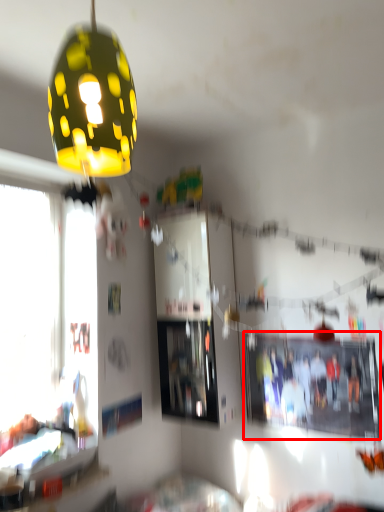
Question: From the image's perspective, what is the correct spatial positioning of bulletin board (annotated by the red box) in reference to lamp?

Choices:
 (A) below
 (B) above

Answer: (A)